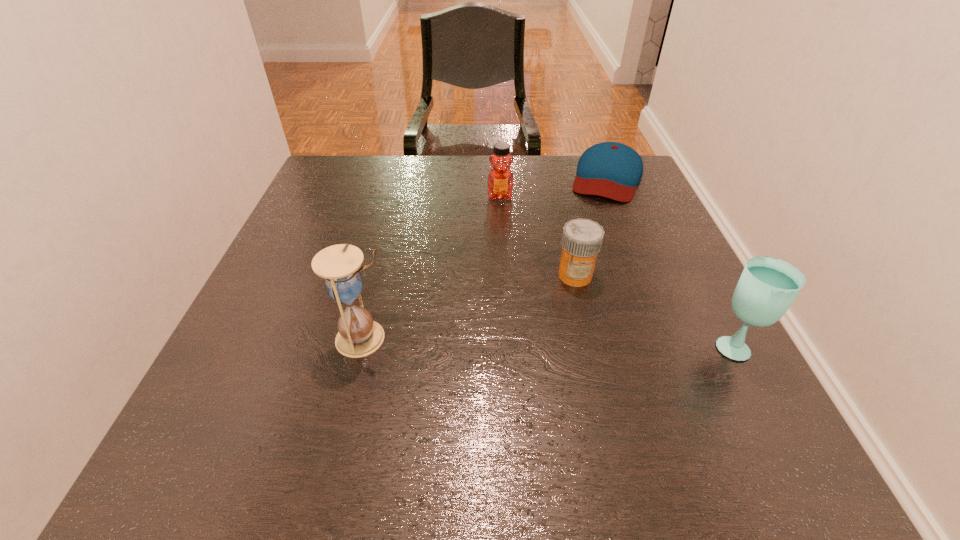
Locate an element on the screen. vacant spot on the desktop that is between the hourglass and the second tallest object and is positioned on the label side of the medicine is located at coordinates (518, 341).

I want to click on vacant space on the desktop that is between the leftmost object and the fourth shortest object and is positioned on the front label of the fourth object from right to left, so click(505, 341).

At what (x,y) coordinates should I click in order to perform the action: click on free spot on the desktop that is between the hourglass and the second tallest object and is positioned with the bill of the baseball cap facing forward. Please return your answer as a coordinate pair (x, y). Image resolution: width=960 pixels, height=540 pixels. Looking at the image, I should click on (552, 341).